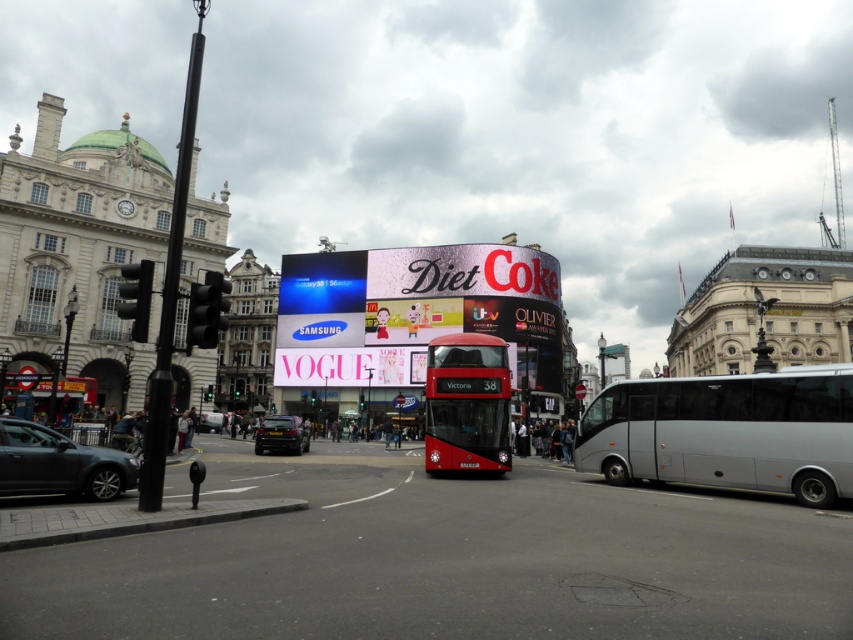
Question: Can you confirm if matte black car at lower left is positioned to the left of metallic silver car at lower left?

Choices:
 (A) yes
 (B) no

Answer: (B)

Question: Which of the following is the farthest from the observer?

Choices:
 (A) red matte bus at center
 (B) silver metallic bus at right
 (C) metallic silver car at lower left

Answer: (C)

Question: Which point is farther to the camera?

Choices:
 (A) matte black car at lower left
 (B) metallic silver car at lower left
 (C) red matte bus at center

Answer: (B)

Question: Is red matte bus at center positioned in front of shiny black car at center?

Choices:
 (A) no
 (B) yes

Answer: (B)

Question: Does shiny black car at center have a lesser width compared to metallic silver car at lower left?

Choices:
 (A) no
 (B) yes

Answer: (A)

Question: Among these points, which one is nearest to the camera?

Choices:
 (A) 672,442
 (B) 282,449
 (C) 460,339
 (D) 213,416

Answer: (A)